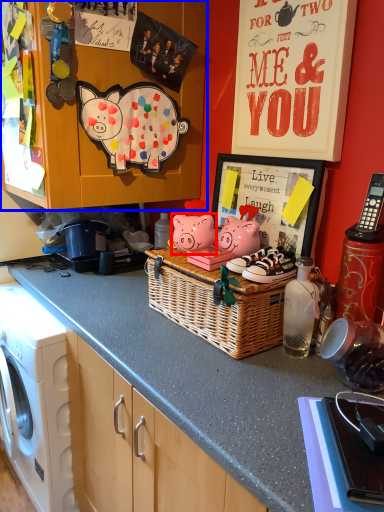
Question: Which of the following is the farthest to the observer, pig (highlighted by a red box) or cabinetry (highlighted by a blue box)?

Choices:
 (A) pig
 (B) cabinetry

Answer: (A)